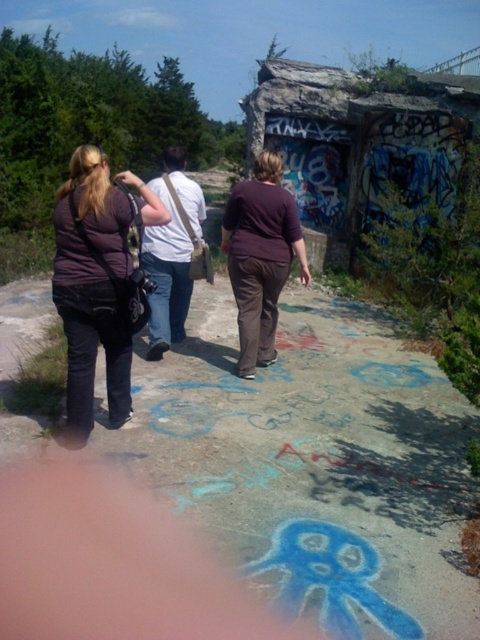
In the scene shown: You are a photographer trying to capture a group photo of the matte purple shirt at center and the white fabric bag at center. Since you want to frame them properly, can you tell me which object is positioned to the right of the other?

The matte purple shirt at center is to the right of the white fabric bag at center according to the description.

You are a photographer trying to capture a photo of the three people walking towards the dilapidated structure. You want to ensure that the matte black pants at center are clearly visible in the photo. Based on their current position at point 0.452, 0.194, where should you position your camera to ensure the pants are in the frame?

To ensure the matte black pants at center are clearly visible, position your camera so that the pants are centered within the frame at coordinates (93, 289). This placement will keep them in focus and within the visual field of the photograph.